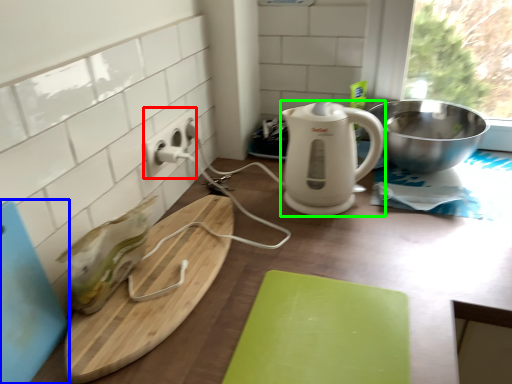
Question: Which object is positioned farthest from electric outlet (highlighted by a red box)? Select from cutting board (highlighted by a blue box) and kitchen appliance (highlighted by a green box).

Choices:
 (A) cutting board
 (B) kitchen appliance

Answer: (A)